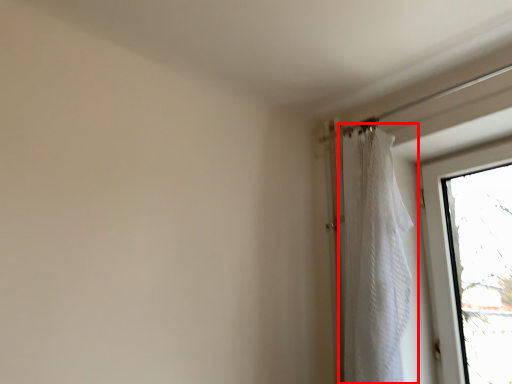
Question: From the image's perspective, what is the correct spatial relationship of curtain (annotated by the red box) in relation to window?

Choices:
 (A) above
 (B) below

Answer: (A)